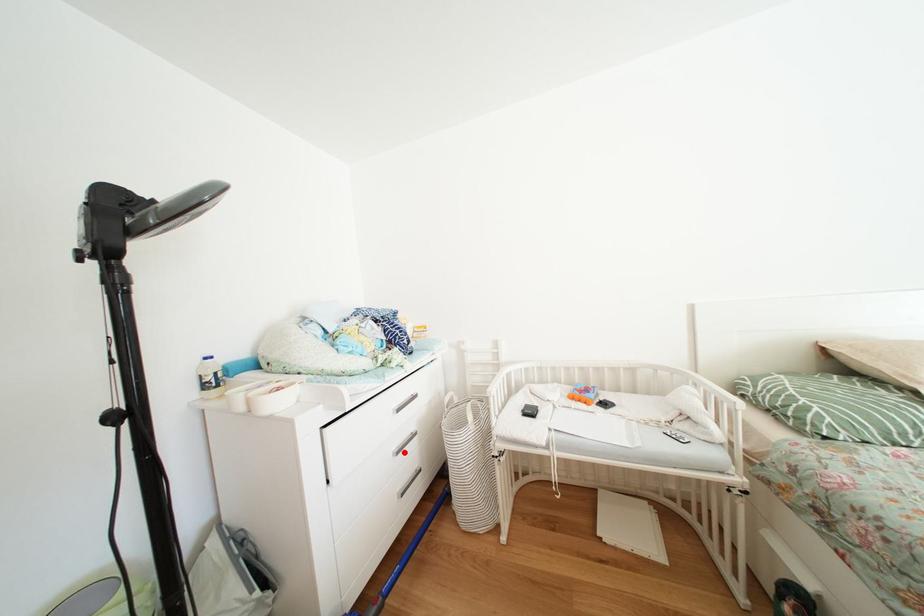
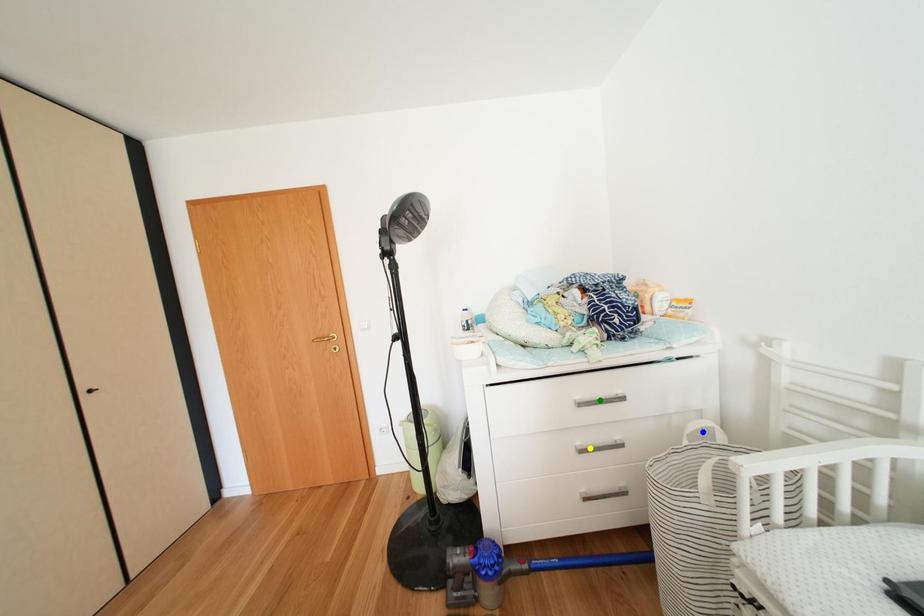
Question: I am providing you with two images of the same scene from different viewpoints. A red point is marked on the first image. You are given multiple points on the second image. Which spot in image 2 lines up with the point in image 1?

Choices:
 (A) blue point
 (B) yellow point
 (C) green point

Answer: (B)